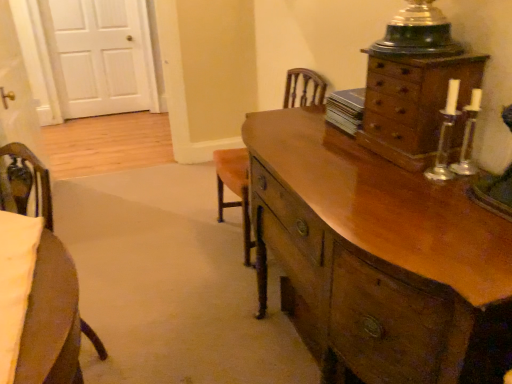
Question: Can you confirm if wooden armchair at center is shorter than white wood door at upper left?

Choices:
 (A) no
 (B) yes

Answer: (B)

Question: Does wooden armchair at center touch white wood door at upper left?

Choices:
 (A) yes
 (B) no

Answer: (B)

Question: Considering the relative sizes of wooden armchair at center and white wood door at upper left in the image provided, is wooden armchair at center smaller than white wood door at upper left?

Choices:
 (A) yes
 (B) no

Answer: (B)

Question: Does wooden armchair at center have a greater height compared to white wood door at upper left?

Choices:
 (A) no
 (B) yes

Answer: (A)

Question: From the image's perspective, is wooden armchair at center on white wood door at upper left?

Choices:
 (A) yes
 (B) no

Answer: (B)

Question: From a real-world perspective, relative to wooden chest of drawers at upper right, the 2th chest of drawers positioned from the bottom, is shiny brown wooden chest of drawers at right, placed as the 2th chest of drawers when sorted from top to bottom, vertically above or below?

Choices:
 (A) below
 (B) above

Answer: (A)

Question: In the image, is shiny brown wooden chest of drawers at right, placed as the 2th chest of drawers when sorted from top to bottom, positioned in front of or behind wooden chest of drawers at upper right, the 2th chest of drawers positioned from the bottom?

Choices:
 (A) front
 (B) behind

Answer: (A)

Question: From the image's perspective, is shiny brown wooden chest of drawers at right, placed as the 2th chest of drawers when sorted from top to bottom, located above or below wooden chest of drawers at upper right, which is the 1th chest of drawers from top to bottom?

Choices:
 (A) above
 (B) below

Answer: (B)

Question: Considering the positions of shiny brown wooden chest of drawers at right, acting as the first chest of drawers starting from the bottom, and wooden chest of drawers at upper right, which is the 1th chest of drawers from top to bottom, in the image, is shiny brown wooden chest of drawers at right, acting as the first chest of drawers starting from the bottom, wider or thinner than wooden chest of drawers at upper right, which is the 1th chest of drawers from top to bottom,?

Choices:
 (A) wide
 (B) thin

Answer: (A)

Question: Considering the positions of point (415, 266) and point (292, 104), is point (415, 266) closer or farther from the camera than point (292, 104)?

Choices:
 (A) farther
 (B) closer

Answer: (B)

Question: In terms of height, does shiny brown wooden chest of drawers at right, acting as the first chest of drawers starting from the bottom, look taller or shorter compared to wooden armchair at center?

Choices:
 (A) short
 (B) tall

Answer: (A)

Question: Considering their positions, is shiny brown wooden chest of drawers at right, placed as the 2th chest of drawers when sorted from top to bottom, located in front of or behind wooden armchair at center?

Choices:
 (A) front
 (B) behind

Answer: (A)

Question: Looking at the image, does shiny brown wooden chest of drawers at right, acting as the first chest of drawers starting from the bottom, seem bigger or smaller compared to wooden armchair at center?

Choices:
 (A) small
 (B) big

Answer: (B)

Question: Is shiny brown wooden chest of drawers at right, placed as the 2th chest of drawers when sorted from top to bottom, in front of or behind white wood door at upper left in the image?

Choices:
 (A) front
 (B) behind

Answer: (A)

Question: Considering the positions of shiny brown wooden chest of drawers at right, acting as the first chest of drawers starting from the bottom, and white wood door at upper left in the image, is shiny brown wooden chest of drawers at right, acting as the first chest of drawers starting from the bottom, bigger or smaller than white wood door at upper left?

Choices:
 (A) big
 (B) small

Answer: (A)